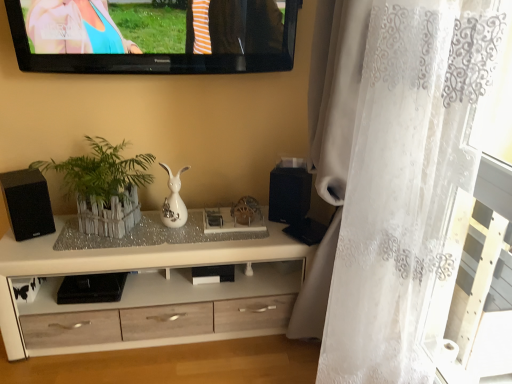
Question: Can you confirm if black matte speaker at center, which is the 1th speaker from right to left, is wider than white wooden fence at center?

Choices:
 (A) no
 (B) yes

Answer: (B)

Question: Is black matte speaker at center, which is counted as the second speaker, starting from the left, facing away from white wooden fence at center?

Choices:
 (A) yes
 (B) no

Answer: (B)

Question: Does black matte speaker at center, which is the 1th speaker from right to left, appear on the right side of white wooden fence at center?

Choices:
 (A) no
 (B) yes

Answer: (B)

Question: Would you say black matte speaker at center, which is counted as the second speaker, starting from the left, contains white wooden fence at center?

Choices:
 (A) yes
 (B) no

Answer: (B)

Question: From the image's perspective, is black matte speaker at center, which is the 1th speaker from right to left, on top of white wooden fence at center?

Choices:
 (A) no
 (B) yes

Answer: (A)

Question: Visually, is white wooden fence at center positioned to the left or to the right of black matte speaker at center, which is the 1th speaker from right to left?

Choices:
 (A) left
 (B) right

Answer: (A)

Question: Looking at their shapes, would you say white wooden fence at center is wider or thinner than black matte speaker at center, which is the 1th speaker from right to left?

Choices:
 (A) wide
 (B) thin

Answer: (B)

Question: Relative to black matte speaker at center, which is the 1th speaker from right to left, is white wooden fence at center in front or behind?

Choices:
 (A) front
 (B) behind

Answer: (A)

Question: Looking at the image, does white wooden fence at center seem bigger or smaller compared to black matte speaker at center, which is counted as the second speaker, starting from the left?

Choices:
 (A) small
 (B) big

Answer: (B)

Question: Based on their sizes in the image, would you say clear glass tray at center is bigger or smaller than white wooden fence at center?

Choices:
 (A) big
 (B) small

Answer: (B)

Question: In the image, is clear glass tray at center positioned in front of or behind white wooden fence at center?

Choices:
 (A) front
 (B) behind

Answer: (B)

Question: Considering the relative positions of clear glass tray at center and white wooden fence at center in the image provided, is clear glass tray at center to the left or to the right of white wooden fence at center?

Choices:
 (A) left
 (B) right

Answer: (B)

Question: Considering the positions of clear glass tray at center and white wooden fence at center in the image, is clear glass tray at center wider or thinner than white wooden fence at center?

Choices:
 (A) thin
 (B) wide

Answer: (A)

Question: Is black matte speaker at center, which is counted as the second speaker, starting from the left, taller or shorter than clear glass tray at center?

Choices:
 (A) short
 (B) tall

Answer: (B)

Question: In terms of width, does black matte speaker at center, which is counted as the second speaker, starting from the left, look wider or thinner when compared to clear glass tray at center?

Choices:
 (A) thin
 (B) wide

Answer: (B)